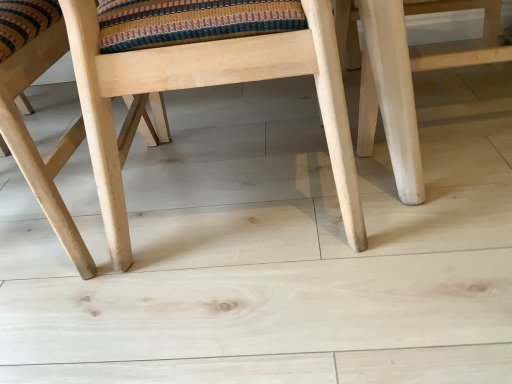
Locate an element on the screen. This screenshot has width=512, height=384. free point in front of natural wood chair at center, the second chair from the left is located at coordinates (265, 312).